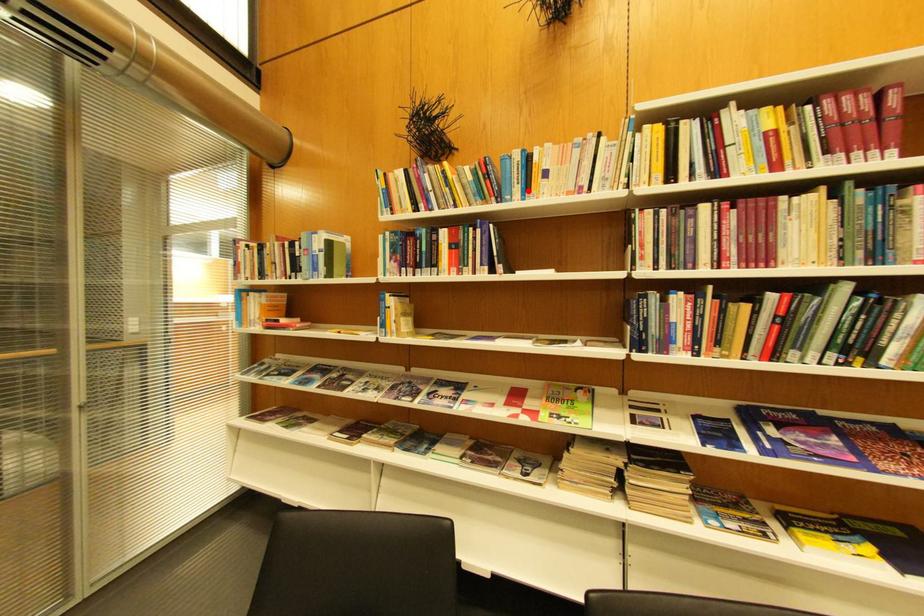
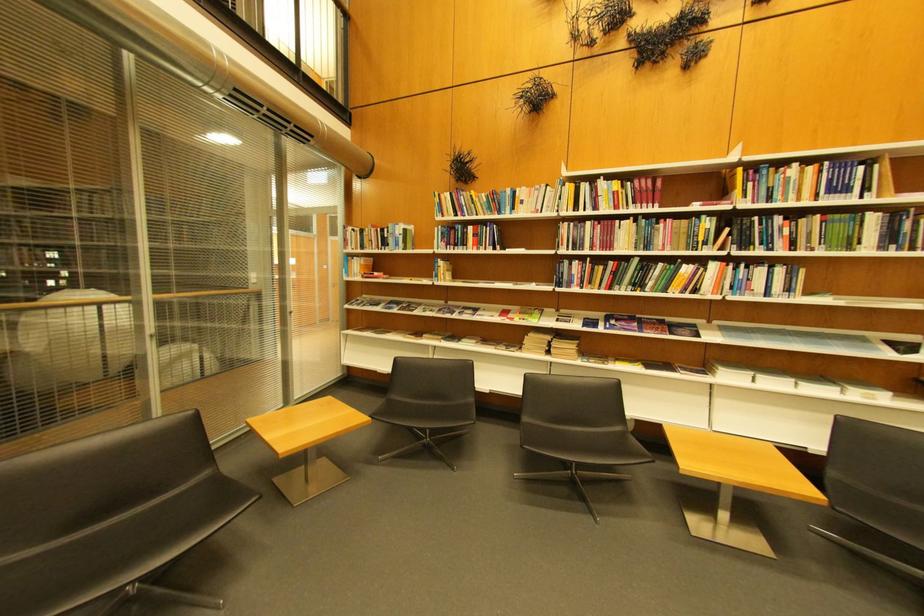
The point at the highlighted location is marked in the first image. Where is the corresponding point in the second image?

(518, 209)